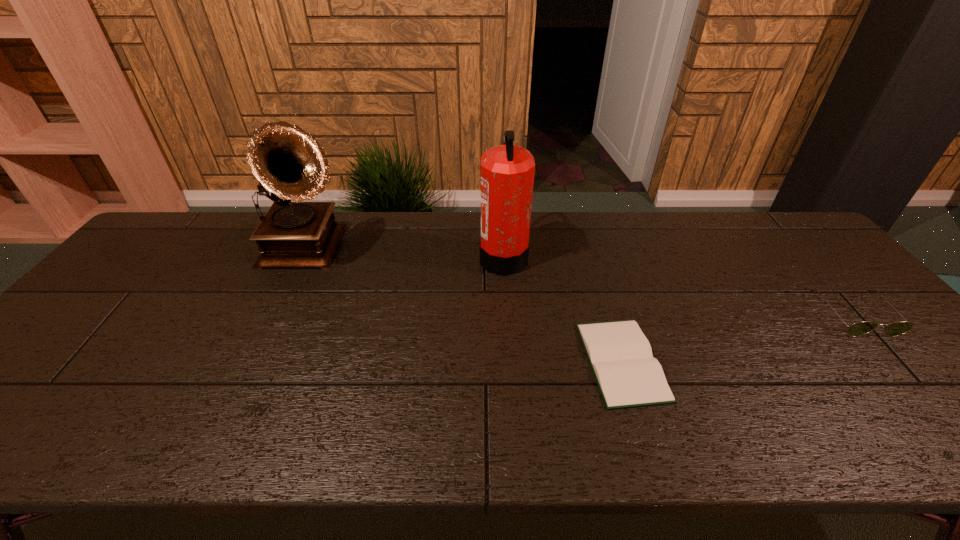
Image resolution: width=960 pixels, height=540 pixels. I want to click on free area in between the hardback book and the second shortest object, so click(x=737, y=338).

Locate an element on the screen. free space between the second object from right to left and the fire extinguisher is located at coordinates (563, 309).

Identify the location of unoccupied area between the sunglasses and the record player. pyautogui.click(x=581, y=283).

Where is `free spot between the third object from right to left and the third tallest object`? free spot between the third object from right to left and the third tallest object is located at coordinates pyautogui.click(x=679, y=286).

The width and height of the screenshot is (960, 540). In order to click on free space between the record player and the fire extinguisher in this screenshot , I will do `click(405, 254)`.

Identify the location of vacant space in between the sunglasses and the hardback book. pos(737,338).

Where is `free spot between the hardback book and the second object from left to right`? free spot between the hardback book and the second object from left to right is located at coordinates (563, 309).

Find the location of a particular element. This screenshot has width=960, height=540. free space between the third object from right to left and the third object from left to right is located at coordinates (563, 309).

This screenshot has width=960, height=540. Identify the location of free area in between the second shortest object and the leftmost object. (581, 283).

Identify which object is located as the third nearest to the second object from right to left. Please provide its 2D coordinates. Your answer should be formatted as a tuple, i.e. [(x, y)], where the tuple contains the x and y coordinates of a point satisfying the conditions above.

[(288, 162)]